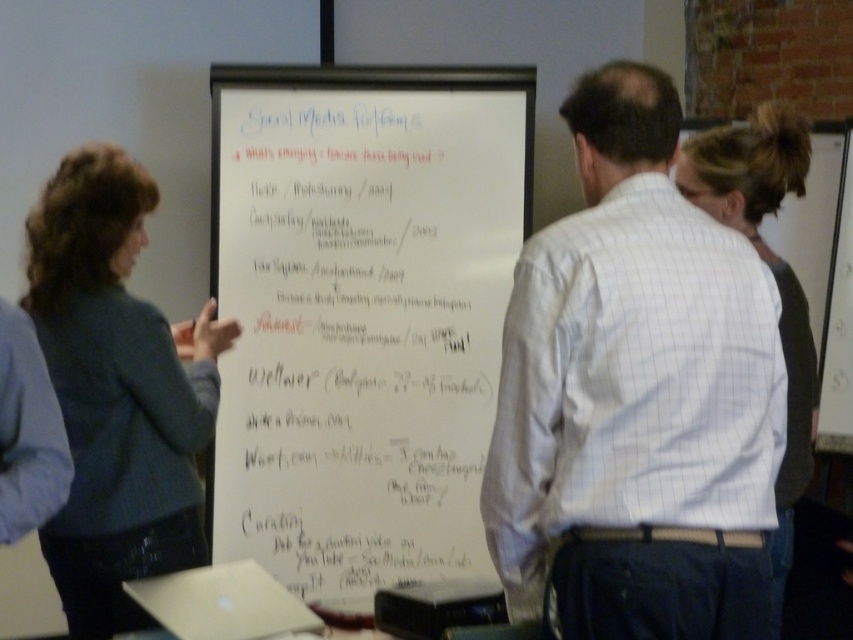
Question: From the image, what is the correct spatial relationship of whiteboard at center in relation to white checkered shirt at center?

Choices:
 (A) above
 (B) below

Answer: (A)

Question: Does whiteboard at center appear under dark brown hair at upper right?

Choices:
 (A) yes
 (B) no

Answer: (B)

Question: Estimate the real-world distances between objects in this image. Which object is closer to the white checkered shirt at center?

Choices:
 (A) whiteboard at center
 (B) dark brown hair at upper right

Answer: (B)

Question: Which object is the farthest from the dark brown hair at upper right?

Choices:
 (A) dark blue sweater at left
 (B) white checkered shirt at center
 (C) whiteboard at center

Answer: (A)

Question: Estimate the real-world distances between objects in this image. Which object is farther from the dark blue sweater at left?

Choices:
 (A) whiteboard at center
 (B) dark brown hair at upper right

Answer: (B)

Question: Is white checkered shirt at center wider than dark brown hair at upper right?

Choices:
 (A) no
 (B) yes

Answer: (B)